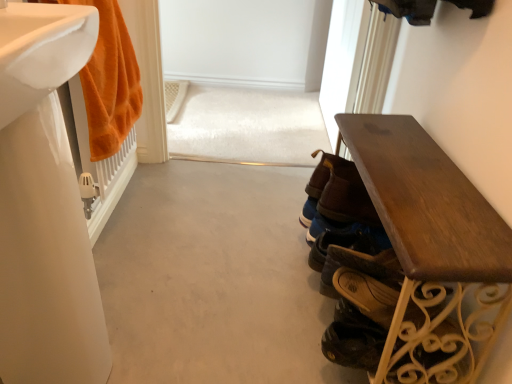
Question: Which direction should I rotate to look at brown leather shoes at center, the first footwear viewed from the back, — up or down?

Choices:
 (A) down
 (B) up

Answer: (A)

Question: Does brown leather shoe at lower right, positioned as the 1th footwear in front-to-back order, lie behind white glossy sink at left, which appears as the first sink when viewed from the top?

Choices:
 (A) yes
 (B) no

Answer: (A)

Question: From the image's perspective, does brown leather shoe at lower right, marked as the second footwear in a back-to-front arrangement, appear lower than white glossy sink at left, which appears as the first sink when viewed from the top?

Choices:
 (A) yes
 (B) no

Answer: (A)

Question: Considering the relative sizes of brown leather shoe at lower right, marked as the second footwear in a back-to-front arrangement, and white glossy sink at left, which appears as the first sink when viewed from the top, in the image provided, is brown leather shoe at lower right, marked as the second footwear in a back-to-front arrangement, smaller than white glossy sink at left, which appears as the first sink when viewed from the top,?

Choices:
 (A) no
 (B) yes

Answer: (B)

Question: Considering the relative sizes of brown leather shoe at lower right, marked as the second footwear in a back-to-front arrangement, and white glossy sink at left, which appears as the first sink when viewed from the top, in the image provided, is brown leather shoe at lower right, marked as the second footwear in a back-to-front arrangement, taller than white glossy sink at left, which appears as the first sink when viewed from the top,?

Choices:
 (A) yes
 (B) no

Answer: (A)

Question: Is brown leather shoe at lower right, marked as the second footwear in a back-to-front arrangement, facing away from white glossy sink at left, the 2th sink when ordered from bottom to top?

Choices:
 (A) yes
 (B) no

Answer: (B)

Question: Is brown leather shoe at lower right, marked as the second footwear in a back-to-front arrangement, bigger than white glossy sink at left, which appears as the first sink when viewed from the top?

Choices:
 (A) no
 (B) yes

Answer: (A)

Question: Is shiny black shoe at lower right, which is counted as the second shoe, starting from the top, positioned before brown leather shoe at lower right, which is counted as the 1th shoe, starting from the top?

Choices:
 (A) yes
 (B) no

Answer: (A)

Question: Can you confirm if shiny black shoe at lower right, which is counted as the second shoe, starting from the top, is smaller than brown leather shoe at lower right, the 2th shoe positioned from the bottom?

Choices:
 (A) no
 (B) yes

Answer: (A)

Question: From the image's perspective, does shiny black shoe at lower right, the first shoe when ordered from bottom to top, appear lower than brown leather shoe at lower right, which is counted as the 1th shoe, starting from the top?

Choices:
 (A) yes
 (B) no

Answer: (A)

Question: Is shiny black shoe at lower right, which is counted as the second shoe, starting from the top, to the right of brown leather shoe at lower right, which is counted as the 1th shoe, starting from the top, from the viewer's perspective?

Choices:
 (A) yes
 (B) no

Answer: (B)

Question: Is shiny black shoe at lower right, the first shoe when ordered from bottom to top, far away from brown leather shoe at lower right, the 2th shoe positioned from the bottom?

Choices:
 (A) yes
 (B) no

Answer: (B)

Question: Is shiny black shoe at lower right, which is counted as the second shoe, starting from the top, wider than brown leather shoe at lower right, which is counted as the 1th shoe, starting from the top?

Choices:
 (A) no
 (B) yes

Answer: (A)

Question: From a real-world perspective, is orange plush towel at left beneath wooden bench at right?

Choices:
 (A) no
 (B) yes

Answer: (A)